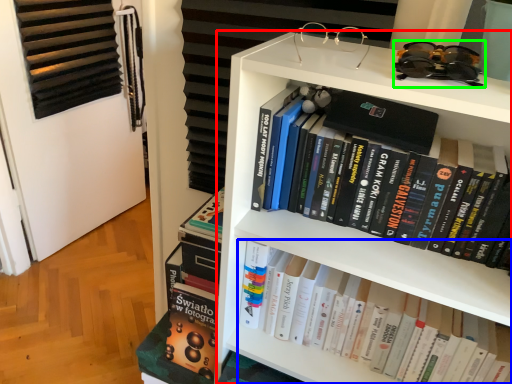
Question: Which object is positioned farthest from bookcase (highlighted by a red box)? Select from book (highlighted by a blue box) and glasses (highlighted by a green box).

Choices:
 (A) book
 (B) glasses

Answer: (B)